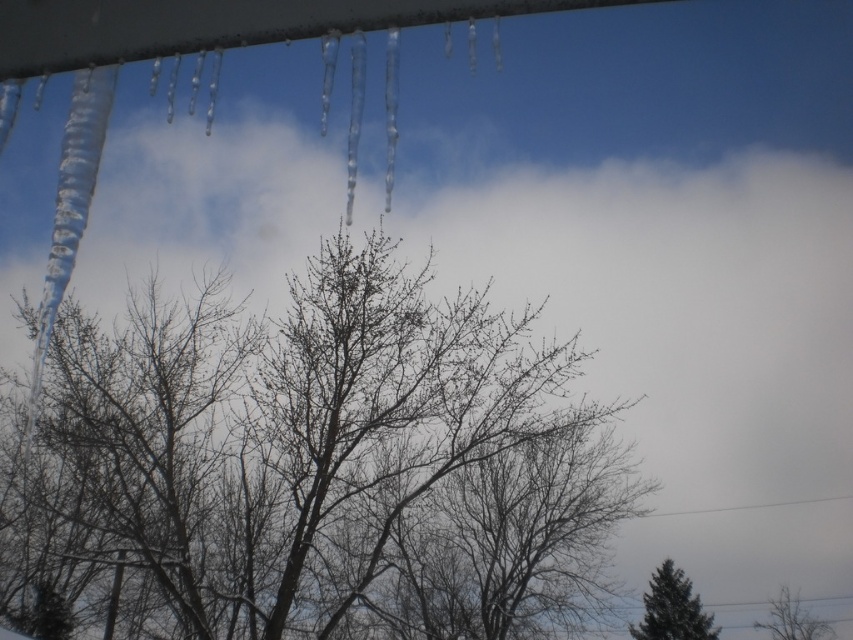
Who is more distant from viewer, (653, 614) or (817, 632)?

The point (817, 632) is more distant.

Is point (688, 630) in front of point (775, 609)?

That is True.

Is point (637, 637) positioned after point (779, 627)?

That is False.

At what (x,y) coordinates should I click in order to perform the action: click on green matte tree at lower right. Please return your answer as a coordinate pair (x, y). Looking at the image, I should click on (672, 609).

Is bare branches at center wider than bare branches at lower right?

Correct, the width of bare branches at center exceeds that of bare branches at lower right.

Which is below, bare branches at center or bare branches at lower right?

Positioned lower is bare branches at lower right.

Who is more forward, (477, 442) or (796, 612)?

Positioned in front is point (477, 442).

You are a GUI agent. You are given a task and a screenshot of the screen. Output one action in this format:
    pyautogui.click(x=<x>, y=<y>)
    Task: Click on the bare branches at center
    The height and width of the screenshot is (640, 853).
    Given the screenshot: What is the action you would take?
    pyautogui.click(x=311, y=468)

Is point (517, 465) behind point (666, 611)?

No, it is not.

In the scene shown: Between bare branches at center and green matte tree at lower right, which one has more height?

bare branches at center

Locate an element on the screen. This screenshot has height=640, width=853. bare branches at center is located at coordinates (x=311, y=468).